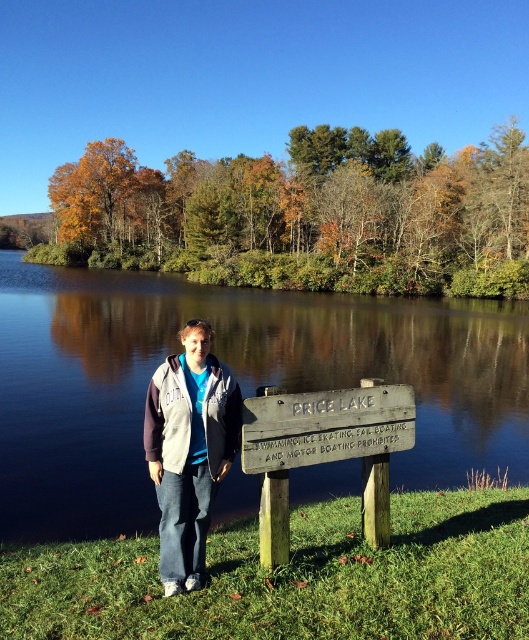
Locate an element on the screen. smooth dark water at center is located at coordinates (236, 378).

Locate an element on the screen. This screenshot has width=529, height=640. smooth dark water at center is located at coordinates (x=236, y=378).

Is point (186, 508) positioned in front of point (315, 397)?

Yes.

Can you confirm if denim jacket at center is shorter than weathered wood sign at center?

Incorrect, denim jacket at center's height does not fall short of weathered wood sign at center's.

The height and width of the screenshot is (640, 529). In order to click on denim jacket at center in this screenshot , I will do `click(188, 449)`.

Is smooth dark water at center closer to the viewer compared to weathered wood sign at center?

No, smooth dark water at center is further to the viewer.

Is smooth dark water at center taller than weathered wood sign at center?

Correct, smooth dark water at center is much taller as weathered wood sign at center.

Describe the element at coordinates (236, 378) in the screenshot. I see `smooth dark water at center` at that location.

I want to click on smooth dark water at center, so click(x=236, y=378).